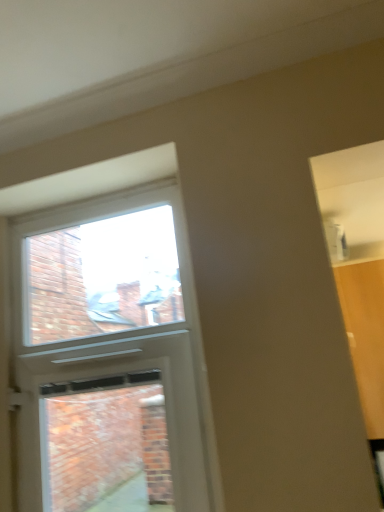
Measure the distance between clear glass window at upper center and camera.

The depth of clear glass window at upper center is 5.46 feet.

Identify the location of clear glass window at upper center. This screenshot has width=384, height=512. (104, 277).

This screenshot has width=384, height=512. What do you see at coordinates (104, 277) in the screenshot? I see `clear glass window at upper center` at bounding box center [104, 277].

Locate an element on the screen. white plastic screen door at upper left is located at coordinates (110, 417).

What do you see at coordinates (110, 417) in the screenshot? This screenshot has width=384, height=512. I see `white plastic screen door at upper left` at bounding box center [110, 417].

Where is `clear glass window at upper center`? clear glass window at upper center is located at coordinates (104, 277).

Considering the relative positions of clear glass window at upper center and white plastic screen door at upper left in the image provided, is clear glass window at upper center to the right of white plastic screen door at upper left from the viewer's perspective?

No, clear glass window at upper center is not to the right of white plastic screen door at upper left.

Based on the photo, does clear glass window at upper center lie in front of white plastic screen door at upper left?

No, it is not.

Considering the positions of point (137, 240) and point (93, 368), is point (137, 240) closer or farther from the camera than point (93, 368)?

Point (137, 240).

From the image's perspective, which is below, clear glass window at upper center or white plastic screen door at upper left?

white plastic screen door at upper left is shown below in the image.

Looking at this image, from a real-world perspective, is clear glass window at upper center positioned above or below white plastic screen door at upper left?

clear glass window at upper center is above white plastic screen door at upper left.

Does clear glass window at upper center have a greater width compared to white plastic screen door at upper left?

In fact, clear glass window at upper center might be narrower than white plastic screen door at upper left.

From their relative heights in the image, would you say clear glass window at upper center is taller or shorter than white plastic screen door at upper left?

Clearly, clear glass window at upper center is shorter compared to white plastic screen door at upper left.

Considering the sizes of objects clear glass window at upper center and white plastic screen door at upper left in the image provided, who is bigger, clear glass window at upper center or white plastic screen door at upper left?

white plastic screen door at upper left.

Is clear glass window at upper center spatially inside white plastic screen door at upper left, or outside of it?

clear glass window at upper center is not enclosed by white plastic screen door at upper left.

Is clear glass window at upper center placed right next to white plastic screen door at upper left?

No, clear glass window at upper center is not in contact with white plastic screen door at upper left.

Is white plastic screen door at upper left at the back of clear glass window at upper center?

That's not correct — clear glass window at upper center is not looking away from white plastic screen door at upper left.

How many degrees apart are the facing directions of clear glass window at upper center and white plastic screen door at upper left?

The facing directions of clear glass window at upper center and white plastic screen door at upper left are 0.000435 degrees apart.

You are a GUI agent. You are given a task and a screenshot of the screen. Output one action in this format:
    pyautogui.click(x=<x>, y=<y>)
    Task: Click on the window screen located above the white plastic screen door at upper left (from a real-world perspective)
    This screenshot has height=512, width=384.
    Given the screenshot: What is the action you would take?
    pyautogui.click(x=104, y=277)

Which object is positioned more to the right, white plastic screen door at upper left or clear glass window at upper center?

white plastic screen door at upper left.

Consider the image. Which object is more forward, white plastic screen door at upper left or clear glass window at upper center?

white plastic screen door at upper left is closer to the camera.

Considering the points (120, 402) and (73, 266), which point is behind, point (120, 402) or point (73, 266)?

Positioned behind is point (120, 402).

From the picture: From the image's perspective, which is below, white plastic screen door at upper left or clear glass window at upper center?

white plastic screen door at upper left appears lower in the image.

From a real-world perspective, which is physically above, white plastic screen door at upper left or clear glass window at upper center?

In real-world perspective, clear glass window at upper center is above.

Is white plastic screen door at upper left wider or thinner than clear glass window at upper center?

white plastic screen door at upper left is wider than clear glass window at upper center.

Based on the photo, considering the relative sizes of white plastic screen door at upper left and clear glass window at upper center in the image provided, is white plastic screen door at upper left shorter than clear glass window at upper center?

In fact, white plastic screen door at upper left may be taller than clear glass window at upper center.

Between white plastic screen door at upper left and clear glass window at upper center, which one has larger size?

white plastic screen door at upper left is bigger.

Is white plastic screen door at upper left inside or outside of clear glass window at upper center?

white plastic screen door at upper left is outside clear glass window at upper center.

In the scene shown: Are white plastic screen door at upper left and clear glass window at upper center beside each other?

They are not placed beside each other.

Is white plastic screen door at upper left oriented away from clear glass window at upper center?

No, white plastic screen door at upper left's orientation is not away from clear glass window at upper center.

What are the coordinates of `window screen located above the white plastic screen door at upper left (from the image's perspective)` in the screenshot? It's located at (104, 277).

At what (x,y) coordinates should I click in order to perform the action: click on window screen above the white plastic screen door at upper left (from the image's perspective). Please return your answer as a coordinate pair (x, y). Looking at the image, I should click on (104, 277).

Where is `window screen located above the white plastic screen door at upper left (from a real-world perspective)`? This screenshot has width=384, height=512. window screen located above the white plastic screen door at upper left (from a real-world perspective) is located at coordinates (104, 277).